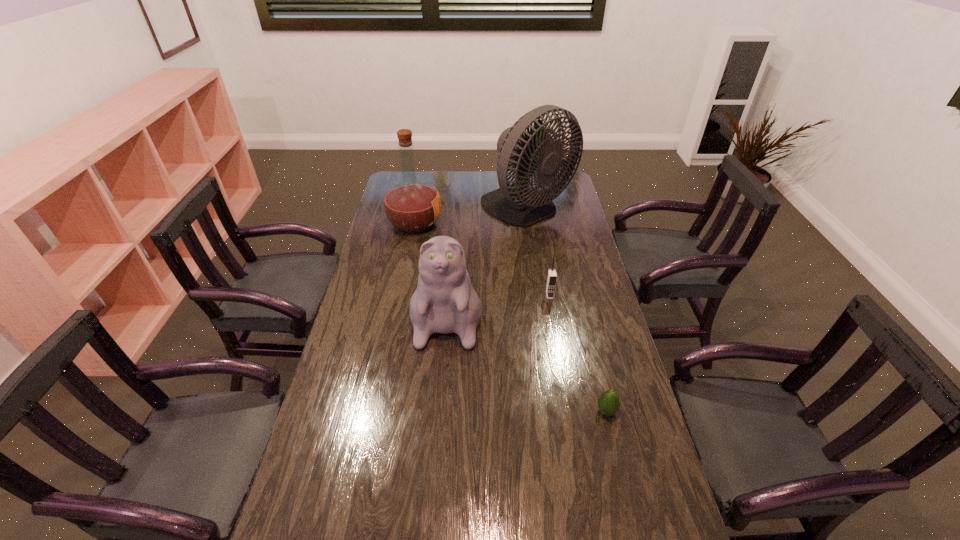
This screenshot has width=960, height=540. Identify the location of vacant area that lies between the cat and the fan. (488, 258).

The image size is (960, 540). What are the coordinates of `vacant point located between the cellular telephone and the third shortest object` in the screenshot? It's located at (498, 300).

Where is `free space between the cellular telephone and the liquor`? This screenshot has width=960, height=540. free space between the cellular telephone and the liquor is located at coordinates (482, 260).

The height and width of the screenshot is (540, 960). In order to click on vacant area that lies between the second shortest object and the shortest object in this screenshot , I will do `click(578, 353)`.

I want to click on vacant space that's between the second shortest object and the shortest object, so click(578, 353).

You are a GUI agent. You are given a task and a screenshot of the screen. Output one action in this format:
    pyautogui.click(x=<x>, y=<y>)
    Task: Click on the vacant point located between the fan and the third shortest object
    Image resolution: width=960 pixels, height=540 pixels.
    Given the screenshot: What is the action you would take?
    pyautogui.click(x=488, y=258)

Identify the location of object that can be found as the fourth closest to the shortest object. The height and width of the screenshot is (540, 960). (412, 205).

Locate which object is the second closest to the liquor. Please provide its 2D coordinates. Your answer should be formatted as a tuple, i.e. [(x, y)], where the tuple contains the x and y coordinates of a point satisfying the conditions above.

[(444, 302)]

At what (x,y) coordinates should I click in order to perform the action: click on vacant position in the image that satisfies the following two spatial constraints: 1. in front of the fan to direct airflow; 2. on the front label of the second tallest object. Please return your answer as a coordinate pair (x, y). Looking at the image, I should click on (530, 224).

Find the location of `free space that satisfies the following two spatial constraints: 1. in front of the fan to direct airflow; 2. on the right side of the avocado`. free space that satisfies the following two spatial constraints: 1. in front of the fan to direct airflow; 2. on the right side of the avocado is located at coordinates (558, 411).